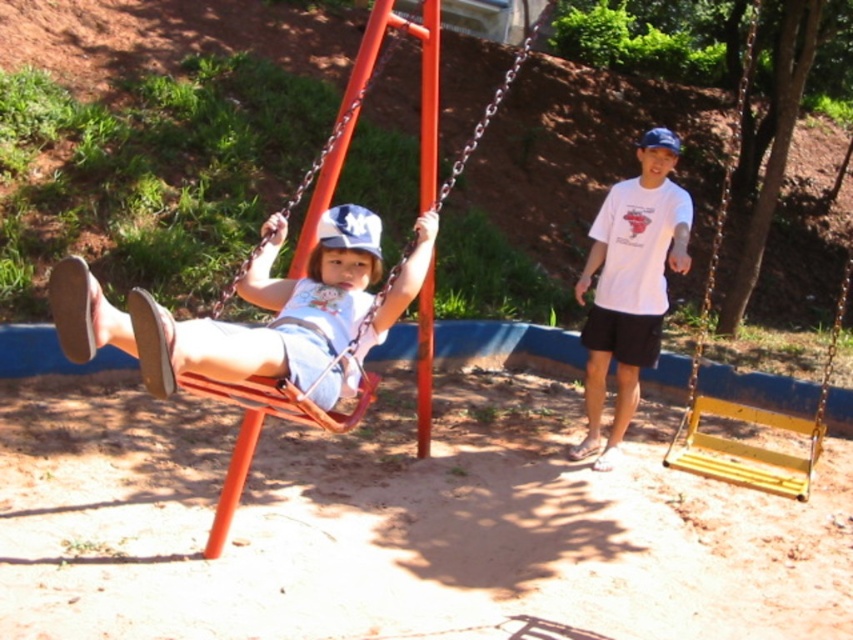
Between point (693, 364) and point (341, 145), which one is positioned in front?

Point (341, 145)

This screenshot has height=640, width=853. Describe the element at coordinates (741, 403) in the screenshot. I see `yellow/yellowish plastic swing at right` at that location.

Between point (701, 312) and point (251, 408), which one is positioned behind?

The point (701, 312) is more distant.

This screenshot has width=853, height=640. Find the location of `yellow/yellowish plastic swing at right`. yellow/yellowish plastic swing at right is located at coordinates (741, 403).

Consider the image. Who is positioned more to the right, matte white shorts at center or white cotton t-shirt at center?

white cotton t-shirt at center

This screenshot has height=640, width=853. I want to click on matte white shorts at center, so click(260, 307).

At what (x,y) coordinates should I click in order to perform the action: click on matte white shorts at center. Please return your answer as a coordinate pair (x, y). This screenshot has height=640, width=853. Looking at the image, I should click on coord(260,307).

Is matte white shorts at center above matte plastic swing at center?

Actually, matte white shorts at center is below matte plastic swing at center.

Where is `matte white shorts at center`? Image resolution: width=853 pixels, height=640 pixels. matte white shorts at center is located at coordinates (x=260, y=307).

Does point (372, 326) come farther from viewer compared to point (338, 420)?

That is True.

The width and height of the screenshot is (853, 640). I want to click on matte white shorts at center, so click(260, 307).